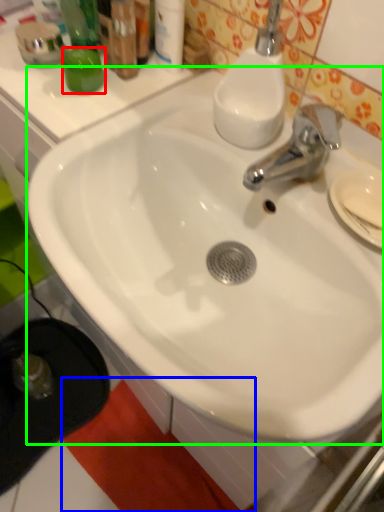
Question: Which object is the closest to the liquid (highlighted by a red box)? Choose among these: beach towel (highlighted by a blue box) or sink (highlighted by a green box).

Choices:
 (A) beach towel
 (B) sink

Answer: (B)